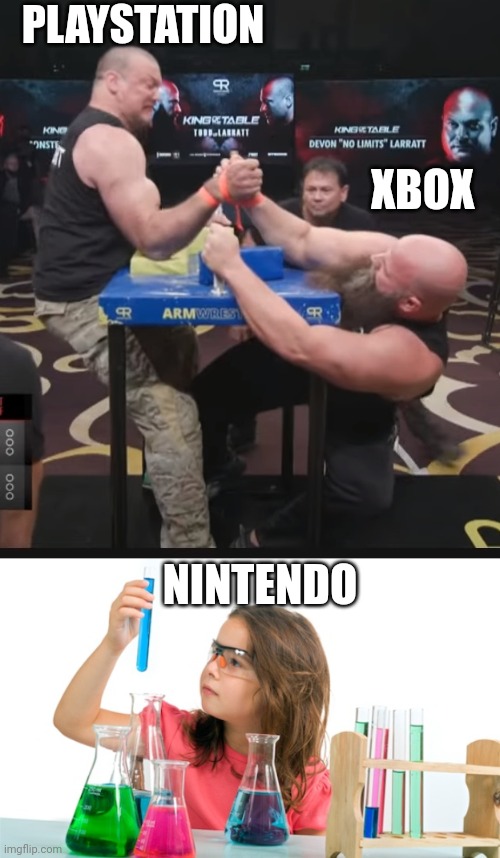
Find the location of a particular element. table is located at coordinates (297, 848).